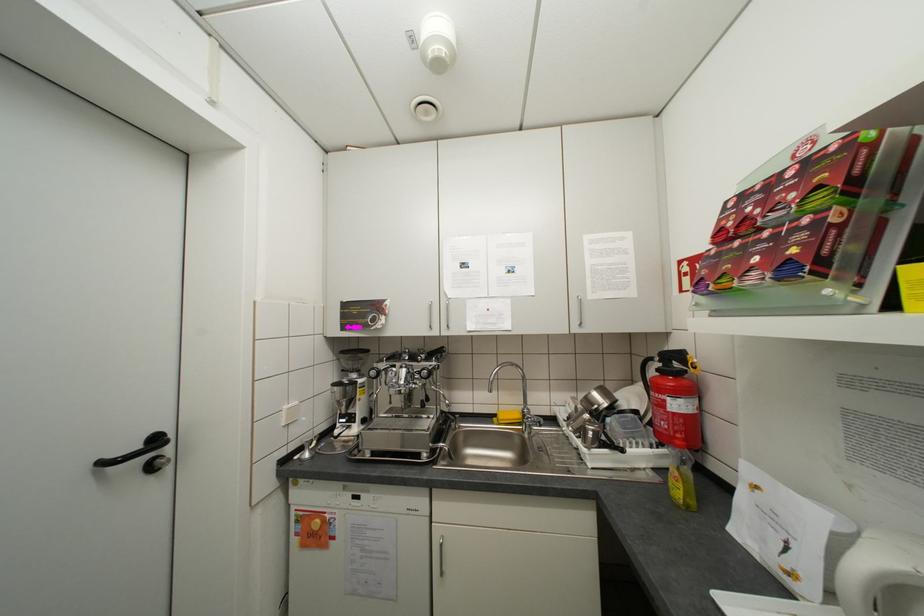
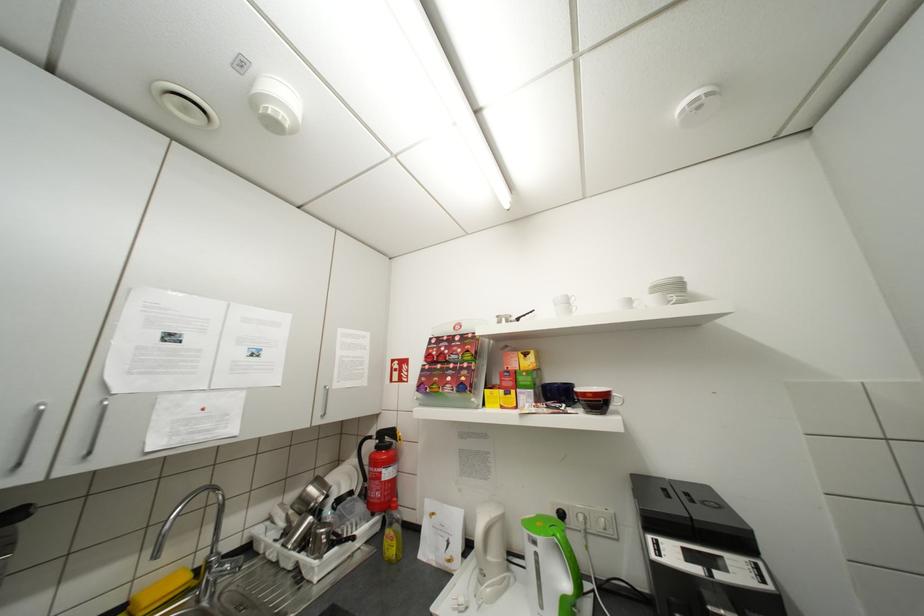
The images are taken continuously from a first-person perspective. In which direction is your viewpoint rotating?

The rotation direction of the camera is right-up.